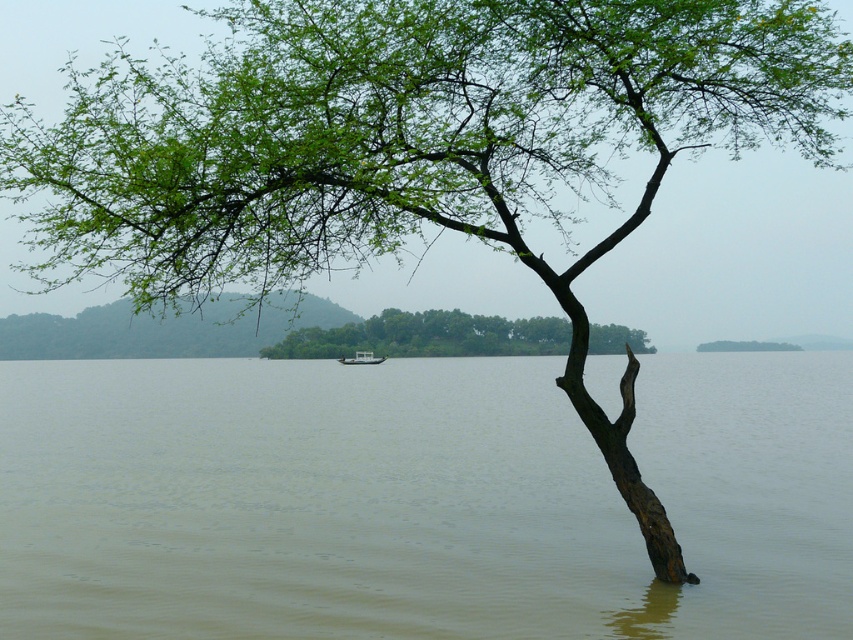
You are standing at the lakeside and want to know what is located at the coordinates point (x=418, y=499). According to the scene description, what is present there?

The point (x=418, y=499) indicates brown murky water at center.